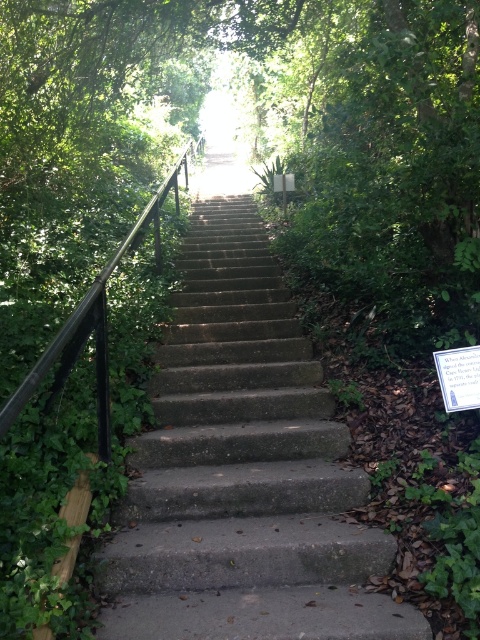
Question: Does concrete stairs at center have a larger size compared to black metal/rail at upper center?

Choices:
 (A) no
 (B) yes

Answer: (B)

Question: Observing the image, what is the correct spatial positioning of concrete stairs at center in reference to black metal/rail at upper center?

Choices:
 (A) below
 (B) above

Answer: (A)

Question: Is concrete stairs at center bigger than black metal/rail at upper center?

Choices:
 (A) no
 (B) yes

Answer: (B)

Question: Which object is farther from the camera taking this photo?

Choices:
 (A) concrete stairs at center
 (B) black metal/rail at upper center

Answer: (B)